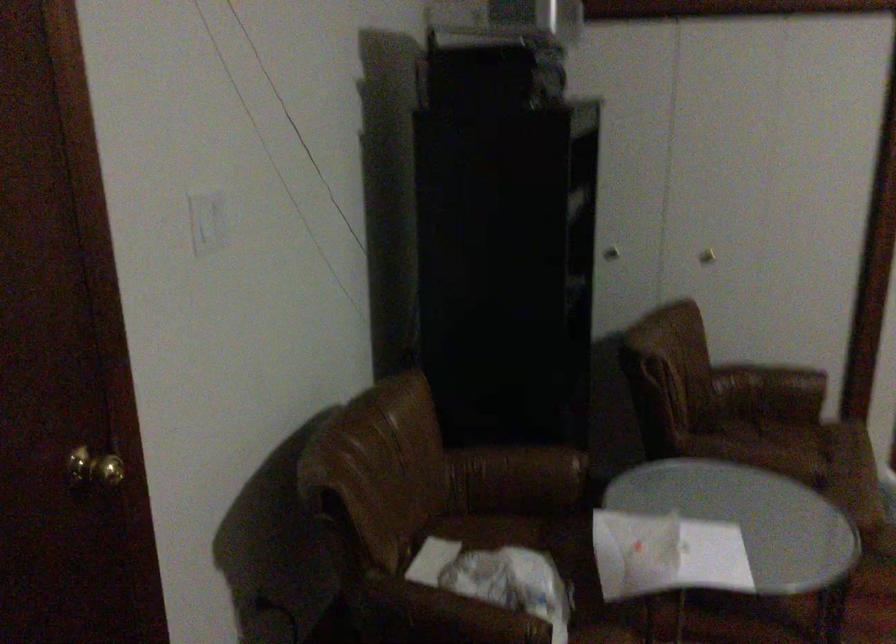
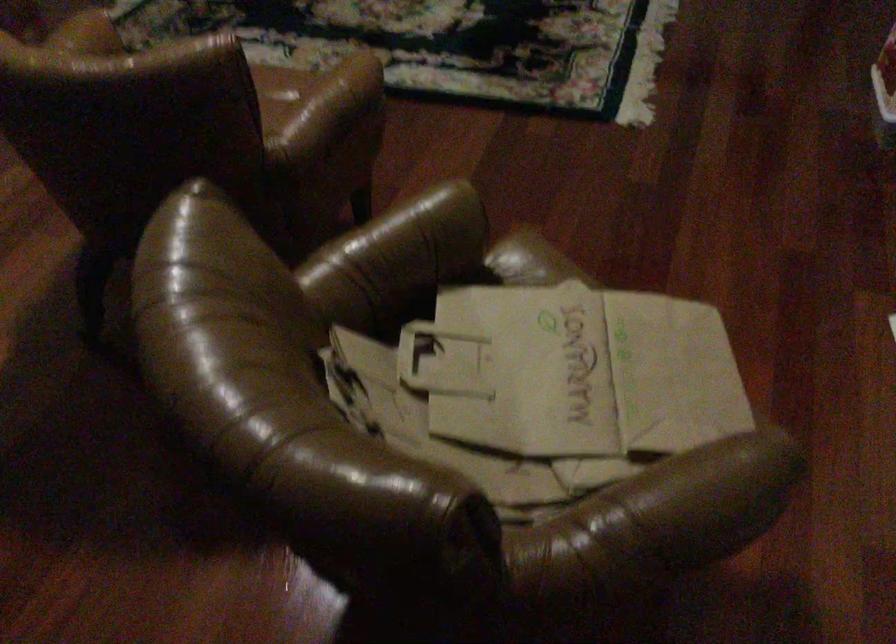
The images are taken continuously from a first-person perspective. In which direction is your viewpoint rotating?

The rotation direction of the camera is right-down.